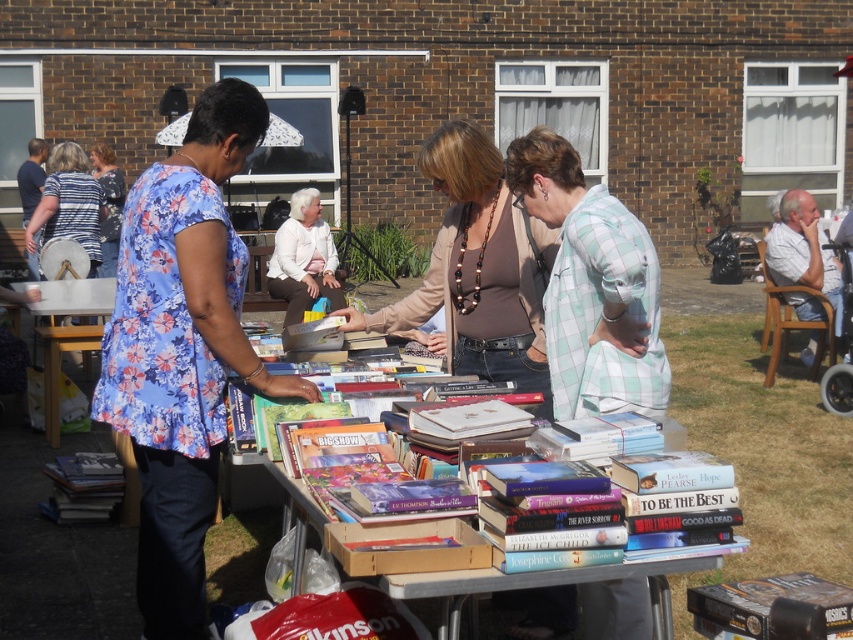
You are a person who needs to pick up the hardcover book at lower left from the wooden table at lower left. If your arm can reach 1.5 meters, can you reach it without moving closer?

The wooden table at lower left is 1.63 meters away from the hardcover book at lower left. Since your arm can only reach 1.5 meters, you cannot reach the hardcover book at lower left without moving closer.

You are organizing a book sale and need to arrange items on a shelf. The shelf has limited space. You have the hardcover book at lower left and the striped fabric blouse at upper left. Which item should you place first to maximize shelf space efficiency?

The hardcover book at lower left has a smaller size compared to the striped fabric blouse at upper left. Therefore, place the smaller hardcover book at lower left first to allow the blouse to occupy the remaining space more efficiently.